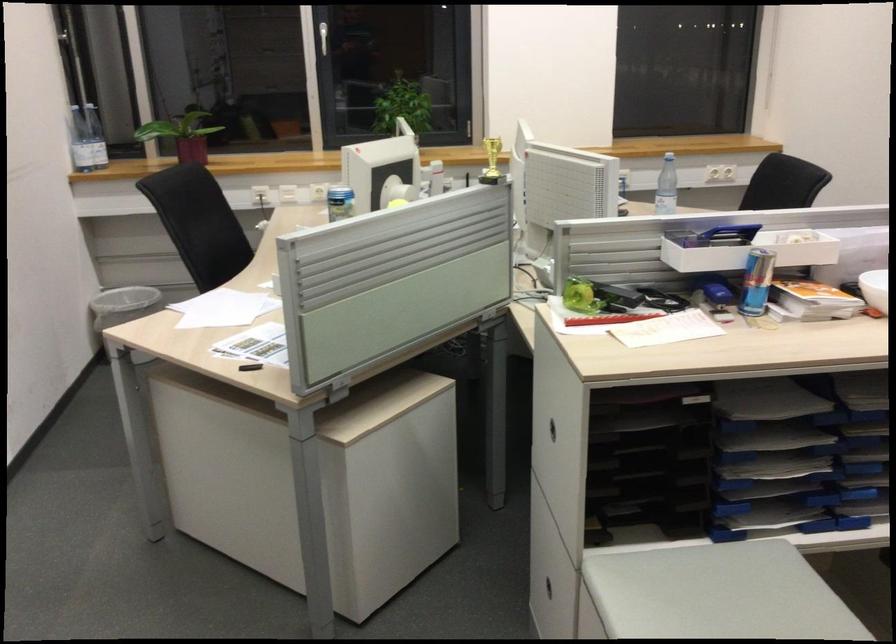
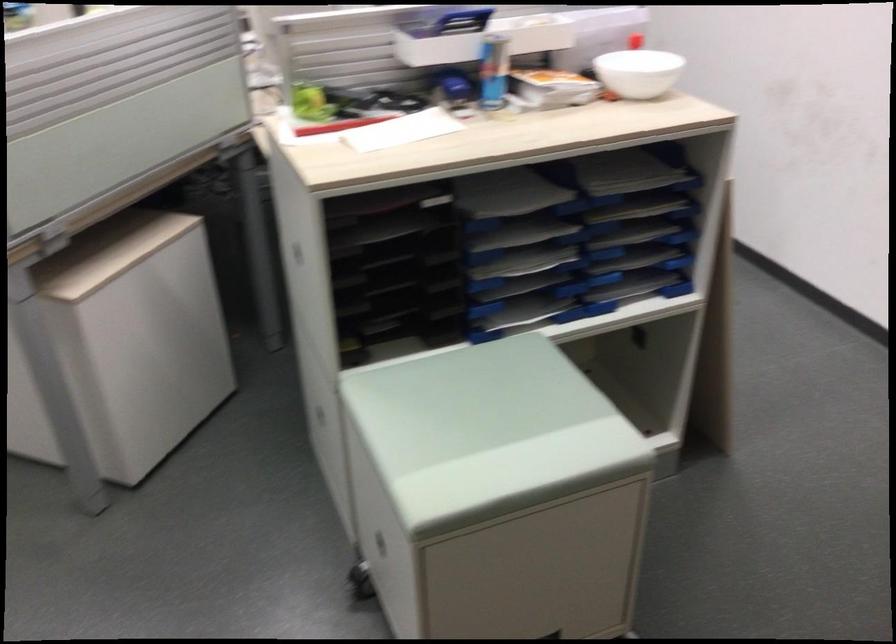
Question: The camera is either moving clockwise (left) or counter-clockwise (right) around the object. The first image is from the beginning of the video and the second image is from the end. Is the camera moving left or right when shooting the video?

Choices:
 (A) Left
 (B) Right

Answer: (A)